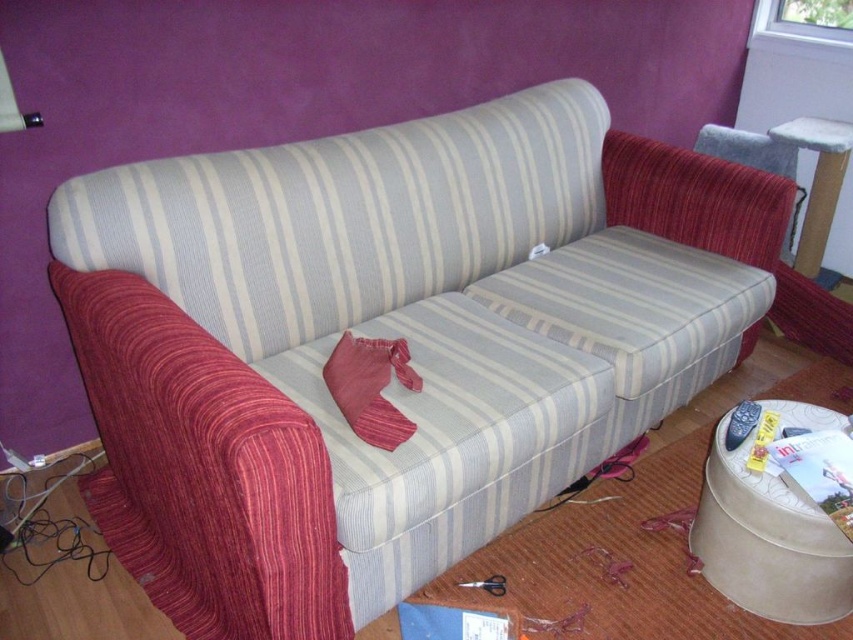
Question: Which object is closer to the camera taking this photo?

Choices:
 (A) velvet-like red pillow at center
 (B) white textured stool at upper right

Answer: (A)

Question: Which point is closer to the camera taking this photo?

Choices:
 (A) (331, 349)
 (B) (819, 193)

Answer: (A)

Question: Can you confirm if velvet-like red pillow at center is positioned to the right of white textured stool at upper right?

Choices:
 (A) yes
 (B) no

Answer: (B)

Question: Can you confirm if velvet-like red pillow at center is positioned below white textured stool at upper right?

Choices:
 (A) no
 (B) yes

Answer: (B)

Question: Is velvet-like red pillow at center bigger than white textured stool at upper right?

Choices:
 (A) no
 (B) yes

Answer: (A)